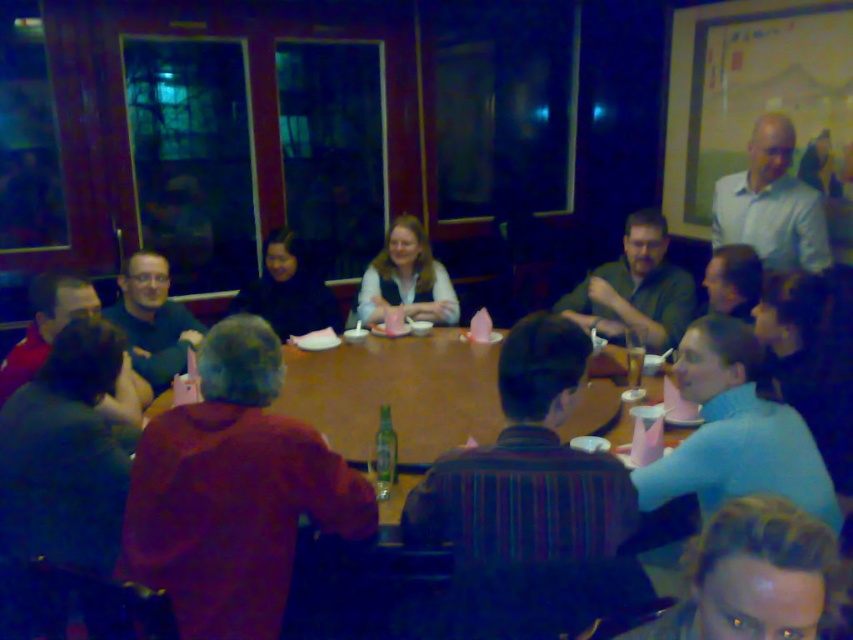
Question: Which point is closer to the camera?

Choices:
 (A) (413, 529)
 (B) (152, 385)
 (C) (86, 305)

Answer: (A)

Question: Can you confirm if dark blue shirt at center is smaller than black matte jacket at center?

Choices:
 (A) no
 (B) yes

Answer: (A)

Question: Which object is positioned farthest from the white matte shirt at upper right?

Choices:
 (A) blue fabric shirt at lower right
 (B) dark brown leather jacket at lower left

Answer: (B)

Question: Is striped fabric shirt at center bigger than translucent glass beer at center?

Choices:
 (A) yes
 (B) no

Answer: (A)

Question: Does dark blue shirt at center come behind dark brown leather jacket at lower left?

Choices:
 (A) no
 (B) yes

Answer: (B)

Question: Based on their relative distances, which object is farther from the matte green shirt at center?

Choices:
 (A) dark brown leather jacket at lower left
 (B) striped fabric shirt at center
 (C) dark brown leather jacket at center
 (D) translucent glass beer at center

Answer: (A)